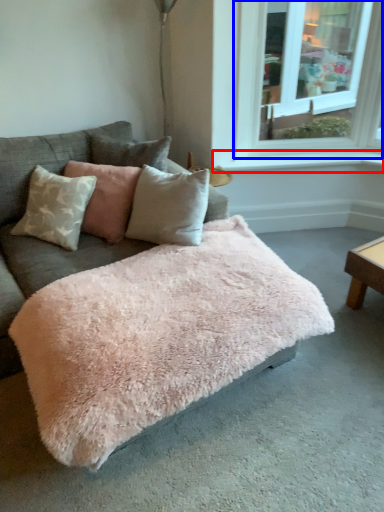
Question: Among these objects, which one is nearest to the camera, window sill (highlighted by a red box) or window (highlighted by a blue box)?

Choices:
 (A) window sill
 (B) window

Answer: (B)